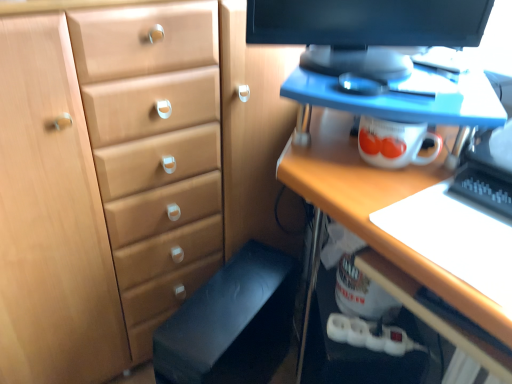
Question: Is light brown wood chest of drawers at center far away from black fabric computer chair at lower center?

Choices:
 (A) no
 (B) yes

Answer: (A)

Question: Can you confirm if light brown wood chest of drawers at center is thinner than black fabric computer chair at lower center?

Choices:
 (A) yes
 (B) no

Answer: (A)

Question: Can you confirm if light brown wood chest of drawers at center is taller than black fabric computer chair at lower center?

Choices:
 (A) yes
 (B) no

Answer: (A)

Question: Would you say light brown wood chest of drawers at center is outside black fabric computer chair at lower center?

Choices:
 (A) yes
 (B) no

Answer: (A)

Question: From the image's perspective, does light brown wood chest of drawers at center appear lower than black fabric computer chair at lower center?

Choices:
 (A) yes
 (B) no

Answer: (B)

Question: Is black fabric computer chair at lower center surrounded by light brown wood chest of drawers at center?

Choices:
 (A) yes
 (B) no

Answer: (B)

Question: Is the position of light brown wood chest of drawers at center less distant than that of black glossy monitor at upper center?

Choices:
 (A) yes
 (B) no

Answer: (A)

Question: Can you confirm if light brown wood chest of drawers at center is wider than black glossy monitor at upper center?

Choices:
 (A) no
 (B) yes

Answer: (B)

Question: Can you confirm if light brown wood chest of drawers at center is smaller than black glossy monitor at upper center?

Choices:
 (A) no
 (B) yes

Answer: (A)

Question: From the image's perspective, is light brown wood chest of drawers at center on black glossy monitor at upper center?

Choices:
 (A) yes
 (B) no

Answer: (B)

Question: Is light brown wood chest of drawers at center placed right next to black glossy monitor at upper center?

Choices:
 (A) no
 (B) yes

Answer: (A)

Question: From the image's perspective, is light brown wood chest of drawers at center below black glossy monitor at upper center?

Choices:
 (A) yes
 (B) no

Answer: (A)

Question: From the image's perspective, is black fabric computer chair at lower center located beneath black glossy monitor at upper center?

Choices:
 (A) no
 (B) yes

Answer: (B)